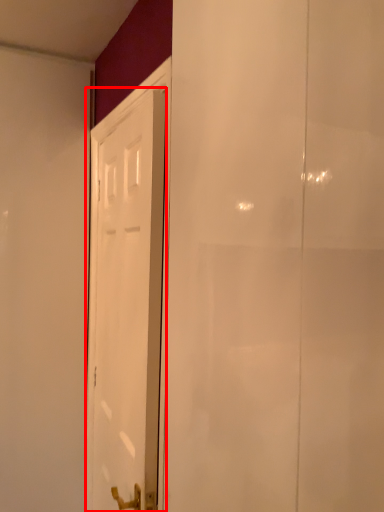
Question: From the image's perspective, where is door (annotated by the red box) located in relation to screen door in the image?

Choices:
 (A) above
 (B) below

Answer: (B)